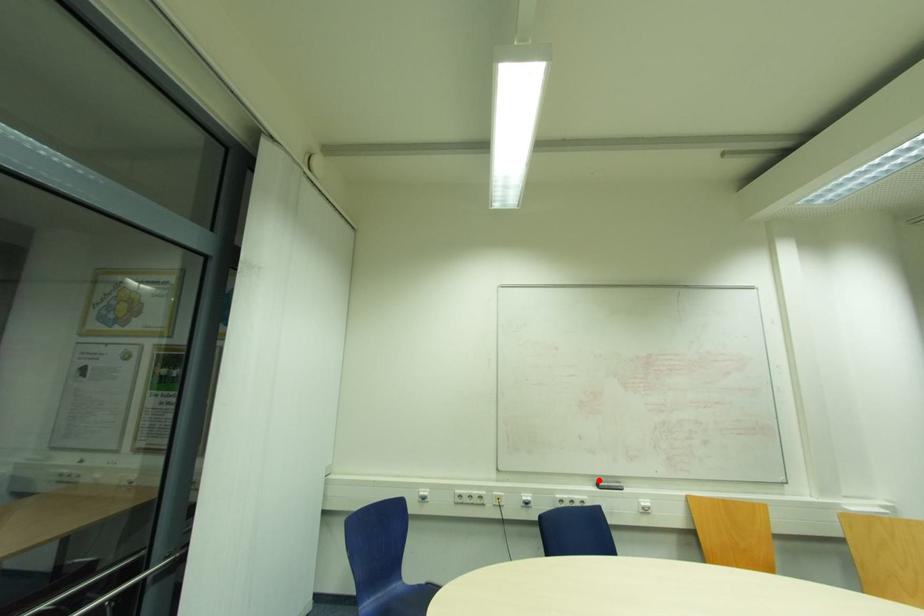
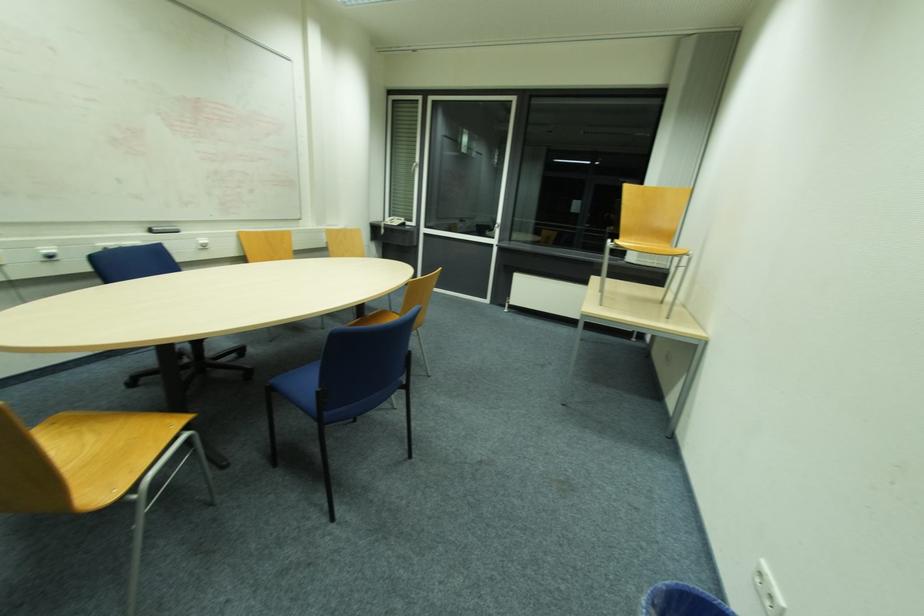
Question: A red point is marked in image1. In image2, is the corresponding 3D point closer to the camera or farther? Reply with the corresponding letter.

Choices:
 (A) The corresponding 3D point is closer.
 (B) The corresponding 3D point is farther.

Answer: (A)